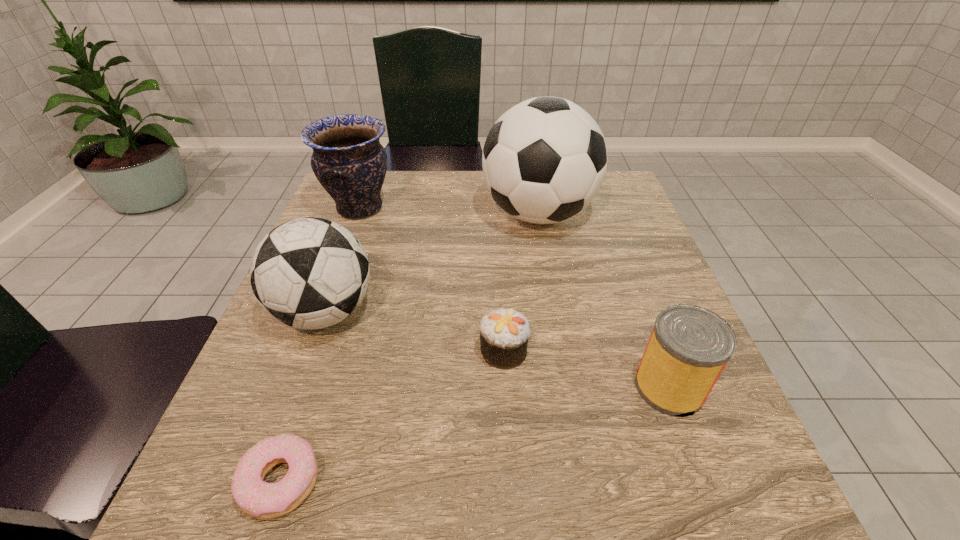
The height and width of the screenshot is (540, 960). Find the location of `the taller soccer ball`. the taller soccer ball is located at coordinates (544, 160).

The height and width of the screenshot is (540, 960). I want to click on the right soccer ball, so click(x=544, y=160).

The height and width of the screenshot is (540, 960). Find the location of `pottery`. pottery is located at coordinates (348, 160).

The width and height of the screenshot is (960, 540). I want to click on the shorter soccer ball, so click(x=310, y=273).

Locate an element on the screen. the nearer soccer ball is located at coordinates (310, 273).

You are a GUI agent. You are given a task and a screenshot of the screen. Output one action in this format:
    pyautogui.click(x=<x>, y=<y>)
    Task: Click on the fourth tallest object
    The image size is (960, 540).
    Given the screenshot: What is the action you would take?
    pyautogui.click(x=689, y=346)

At what (x,y) coordinates should I click in order to perform the action: click on the fifth tallest object. Please return your answer as a coordinate pair (x, y). Looking at the image, I should click on point(504,333).

At what (x,y) coordinates should I click in order to perform the action: click on the nearest object. Please return your answer as a coordinate pair (x, y). Looking at the image, I should click on (257, 498).

Locate an element on the screen. The image size is (960, 540). doughnut is located at coordinates (257, 498).

Image resolution: width=960 pixels, height=540 pixels. I want to click on free space located 0.330m on the left of the taller soccer ball, so pyautogui.click(x=353, y=214).